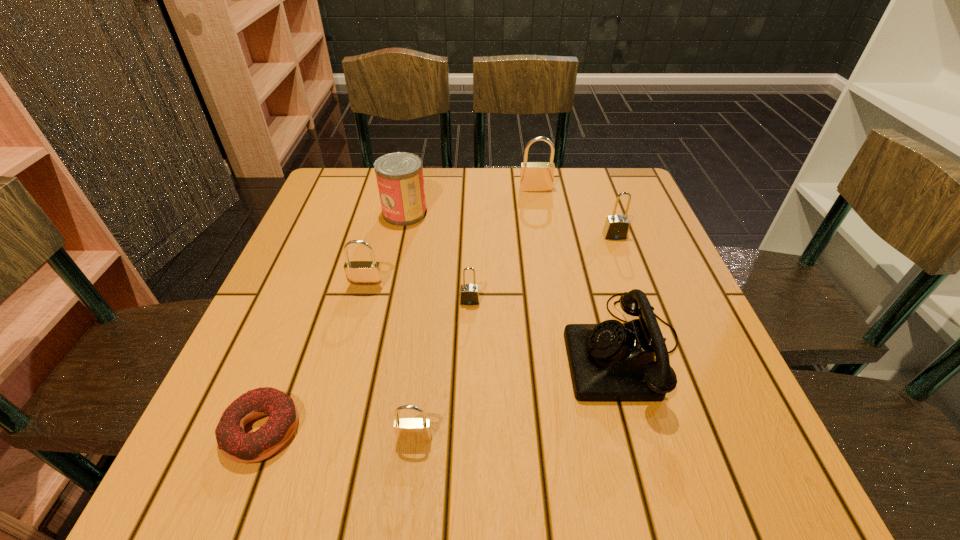
Find the location of a particular element. The height and width of the screenshot is (540, 960). the closest brass padlock to the second farthest object is located at coordinates (360, 274).

Identify which brass padlock is the closest to the leftmost padlock. Please provide its 2D coordinates. Your answer should be formatted as a tuple, i.e. [(x, y)], where the tuple contains the x and y coordinates of a point satisfying the conditions above.

[(407, 430)]

Where is `free location that satisfies the following two spatial constraints: 1. on the front face of the telephone; 2. on the front side of the doughnut`? The image size is (960, 540). free location that satisfies the following two spatial constraints: 1. on the front face of the telephone; 2. on the front side of the doughnut is located at coordinates (648, 430).

The height and width of the screenshot is (540, 960). I want to click on vacant space that satisfies the following two spatial constraints: 1. on the shackle of the right gray padlock; 2. on the front face of the telephone, so click(655, 348).